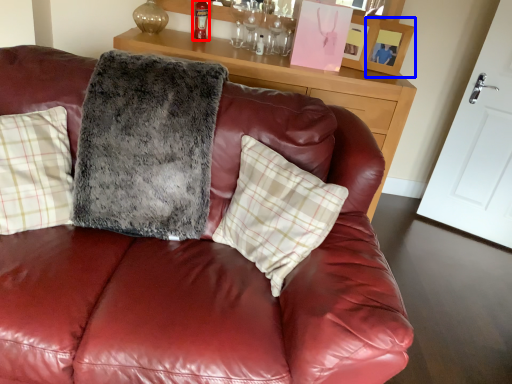
Question: Which object appears closest to the camera in this image, alcohol (highlighted by a red box) or picture frame (highlighted by a blue box)?

Choices:
 (A) alcohol
 (B) picture frame

Answer: (B)